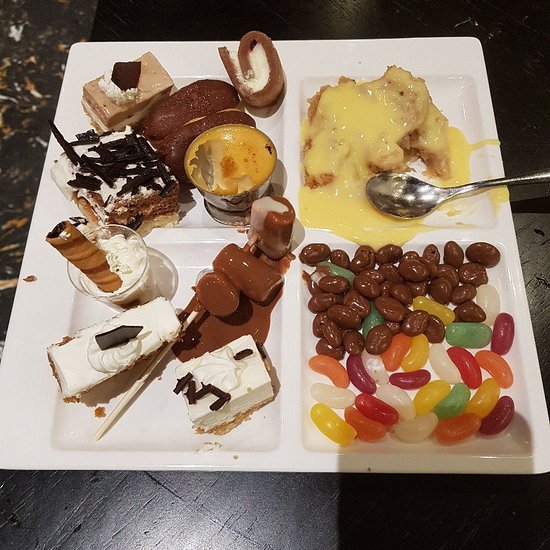
Where is `spoon`? The image size is (550, 550). spoon is located at coordinates (410, 187).